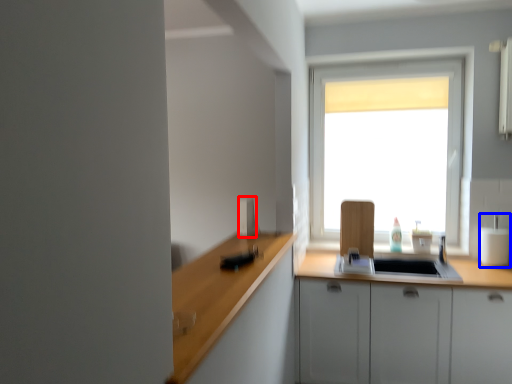
Question: Which point is closer to the camera, appliance (highlighted by a red box) or appliance (highlighted by a blue box)?

Choices:
 (A) appliance
 (B) appliance

Answer: (A)